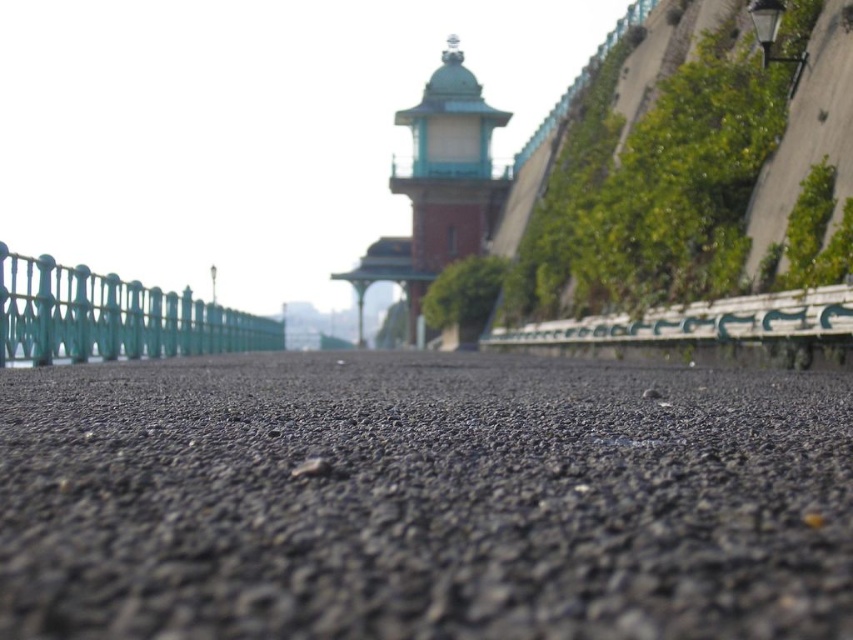
You are a gardener planning to plant flowers between the black gravel at center and the teal glossy fence at left. Considering their heights, which object should you place the flowers closer to?

You should place the flowers closer to the black gravel at center because it has a lesser height compared to the teal glossy fence at left, providing more space for the flowers to grow without obstruction.

You are standing at the starting point of the pathway and want to reach the structure in the distance. There are two points marked on the path, point 1 at coordinates point (49,426) and point 2 at coordinates point (62,349). Which point is closer to you as you stand at the beginning of the path?

Point (49,426) is closer to the viewer than point (62,349), so point 1 is closer to you as you stand at the beginning of the path.

You are standing on the pathway and see the black gravel at center and the teal glossy fence at left. Which object is positioned to the right of the other?

The black gravel at center is to the right of the teal glossy fence at left.